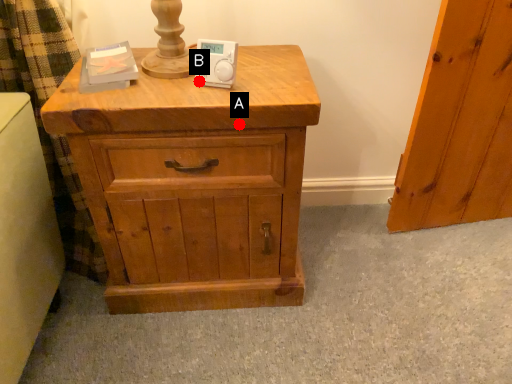
Question: Two points are circled on the image, labeled by A and B beside each circle. Which point is closer to the camera?

Choices:
 (A) A is closer
 (B) B is closer

Answer: (A)